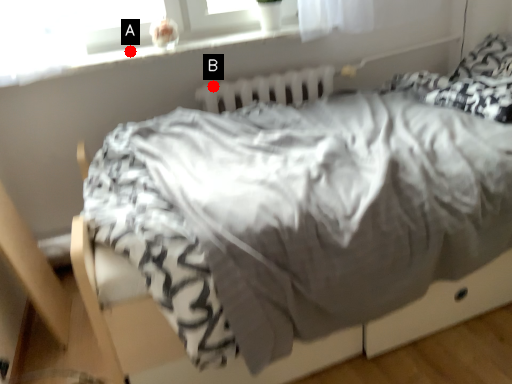
Question: Two points are circled on the image, labeled by A and B beside each circle. Among these points, which one is nearest to the camera?

Choices:
 (A) A is closer
 (B) B is closer

Answer: (A)